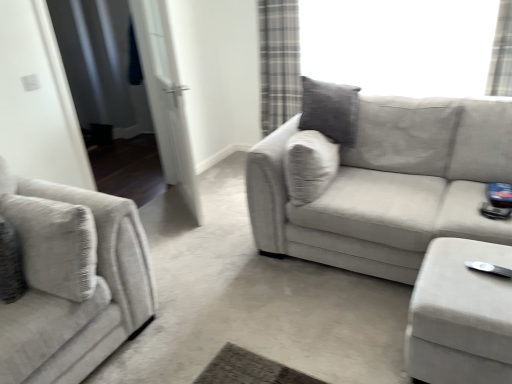
What do you see at coordinates (501, 54) in the screenshot? I see `plaid fabric curtain at upper right` at bounding box center [501, 54].

Identify the location of plaid fabric curtain at upper right. The width and height of the screenshot is (512, 384). (501, 54).

What do you see at coordinates (165, 97) in the screenshot?
I see `white glossy door at left, which is the 2th screen door from left to right` at bounding box center [165, 97].

The width and height of the screenshot is (512, 384). Find the location of `velvet beige ottoman at lower right`. velvet beige ottoman at lower right is located at coordinates (460, 316).

At what (x,y) coordinates should I click in order to perform the action: click on white plastic wii controller at lower right. Please return your answer as a coordinate pair (x, y). The height and width of the screenshot is (384, 512). Looking at the image, I should click on (x=489, y=269).

Consider the image. Which object is closer to the camera taking this photo, textured gray couch at left, placed as the 2th studio couch when sorted from right to left, or velvet beige ottoman at lower right?

textured gray couch at left, placed as the 2th studio couch when sorted from right to left, is closer to the camera.

Is point (82, 301) in front of point (463, 282)?

No, (82, 301) is further to viewer.

Considering the positions of objects textured gray couch at left, the 1th studio couch from the left, and velvet beige ottoman at lower right in the image provided, who is more to the left, textured gray couch at left, the 1th studio couch from the left, or velvet beige ottoman at lower right?

From the viewer's perspective, textured gray couch at left, the 1th studio couch from the left, appears more on the left side.

Is textured gray couch at left, placed as the 2th studio couch when sorted from right to left, next to velvet beige ottoman at lower right?

No, textured gray couch at left, placed as the 2th studio couch when sorted from right to left, is not next to velvet beige ottoman at lower right.

Based on their sizes in the image, would you say textured gray couch at left, the 1th studio couch from the left, is bigger or smaller than plaid fabric curtain at upper right?

Clearly, textured gray couch at left, the 1th studio couch from the left, is larger in size than plaid fabric curtain at upper right.

Can we say textured gray couch at left, placed as the 2th studio couch when sorted from right to left, lies outside plaid fabric curtain at upper right?

Yes.

Considering the positions of objects textured gray couch at left, the 1th studio couch from the left, and plaid fabric curtain at upper right in the image provided, who is behind, textured gray couch at left, the 1th studio couch from the left, or plaid fabric curtain at upper right?

plaid fabric curtain at upper right.

Considering the relative sizes of white plastic wii controller at lower right and textured gray couch at left, placed as the 2th studio couch when sorted from right to left, in the image provided, is white plastic wii controller at lower right smaller than textured gray couch at left, placed as the 2th studio couch when sorted from right to left,?

Indeed, white plastic wii controller at lower right has a smaller size compared to textured gray couch at left, placed as the 2th studio couch when sorted from right to left.

Would you say textured gray couch at left, placed as the 2th studio couch when sorted from right to left, is part of white plastic wii controller at lower right's contents?

That's incorrect, textured gray couch at left, placed as the 2th studio couch when sorted from right to left, is not inside white plastic wii controller at lower right.

Is the surface of white plastic wii controller at lower right in direct contact with textured gray couch at left, placed as the 2th studio couch when sorted from right to left?

No, white plastic wii controller at lower right is not beside textured gray couch at left, placed as the 2th studio couch when sorted from right to left.

Does point (486, 271) lie behind point (40, 210)?

That is False.

From the image's perspective, who appears lower, white fabric screen door at left, which is the 2th screen door in right-to-left order, or textured beige couch at center, which ranks as the second studio couch in left-to-right order?

textured beige couch at center, which ranks as the second studio couch in left-to-right order.

Is white fabric screen door at left, positioned as the first screen door in left-to-right order, not near textured beige couch at center, marked as the first studio couch in a right-to-left arrangement?

Indeed, white fabric screen door at left, positioned as the first screen door in left-to-right order, is not near textured beige couch at center, marked as the first studio couch in a right-to-left arrangement.

Which object is wider, white fabric screen door at left, positioned as the first screen door in left-to-right order, or textured beige couch at center, which ranks as the second studio couch in left-to-right order?

textured beige couch at center, which ranks as the second studio couch in left-to-right order, is wider.

Which object is further away from the camera, white fabric screen door at left, which is the 2th screen door in right-to-left order, or plaid fabric curtain at upper right?

plaid fabric curtain at upper right.

Is white fabric screen door at left, which is the 2th screen door in right-to-left order, to the left of plaid fabric curtain at upper right from the viewer's perspective?

Yes.

Identify the location of curtain behind the white fabric screen door at left, which is the 2th screen door in right-to-left order. (501, 54).

From a real-world perspective, which object stands above the other?

plaid fabric curtain at upper right, from a real-world perspective.

Which is behind, plaid fabric curtain at upper right or velvet beige ottoman at lower right?

Positioned behind is plaid fabric curtain at upper right.

Is plaid fabric curtain at upper right spatially inside velvet beige ottoman at lower right, or outside of it?

plaid fabric curtain at upper right is located beyond the bounds of velvet beige ottoman at lower right.

Which object is positioned more to the left, plaid fabric curtain at upper right or velvet beige ottoman at lower right?

Positioned to the left is velvet beige ottoman at lower right.

You are a GUI agent. You are given a task and a screenshot of the screen. Output one action in this format:
    pyautogui.click(x=<x>, y=<y>)
    Task: Click on the curtain above the white plastic wii controller at lower right (from a real-world perspective)
    The width and height of the screenshot is (512, 384).
    Given the screenshot: What is the action you would take?
    pyautogui.click(x=501, y=54)

Considering the sizes of objects white plastic wii controller at lower right and plaid fabric curtain at upper right in the image provided, who is smaller, white plastic wii controller at lower right or plaid fabric curtain at upper right?

white plastic wii controller at lower right is smaller.

Considering the relative positions of white plastic wii controller at lower right and plaid fabric curtain at upper right in the image provided, is white plastic wii controller at lower right to the right of plaid fabric curtain at upper right from the viewer's perspective?

Incorrect, white plastic wii controller at lower right is not on the right side of plaid fabric curtain at upper right.

Image resolution: width=512 pixels, height=384 pixels. Identify the location of studio couch in front of the velvet beige ottoman at lower right. (71, 280).

I want to click on curtain behind the textured gray couch at left, placed as the 2th studio couch when sorted from right to left, so click(501, 54).

Looking at the image, which one is located closer to plaid fabric curtain at upper right, white glossy door at left, marked as the 1th screen door in a right-to-left arrangement, or white fabric screen door at left, positioned as the first screen door in left-to-right order?

Based on the image, white glossy door at left, marked as the 1th screen door in a right-to-left arrangement, appears to be nearer to plaid fabric curtain at upper right.

From the picture: Which object lies nearer to the anchor point white plastic wii controller at lower right, textured gray couch at left, the 1th studio couch from the left, or white glossy door at left, marked as the 1th screen door in a right-to-left arrangement?

textured gray couch at left, the 1th studio couch from the left, is closer to white plastic wii controller at lower right.

When comparing their distances from plaid fabric curtain at upper right, does velvet beige ottoman at lower right or white fabric screen door at left, which is the 2th screen door in right-to-left order, seem closer?

Among the two, velvet beige ottoman at lower right is located nearer to plaid fabric curtain at upper right.

Based on their spatial positions, is plaid fabric curtain at upper right or textured gray couch at left, placed as the 2th studio couch when sorted from right to left, further from velvet beige ottoman at lower right?

Based on the image, plaid fabric curtain at upper right appears to be further to velvet beige ottoman at lower right.

Looking at the image, which one is located closer to white glossy door at left, which is the 2th screen door from left to right, textured beige couch at center, which ranks as the second studio couch in left-to-right order, or textured gray couch at left, placed as the 2th studio couch when sorted from right to left?

textured beige couch at center, which ranks as the second studio couch in left-to-right order, lies closer to white glossy door at left, which is the 2th screen door from left to right, than the other object.

Based on their spatial positions, is white glossy door at left, which is the 2th screen door from left to right, or plaid fabric curtain at upper right further from velvet beige ottoman at lower right?

plaid fabric curtain at upper right is further to velvet beige ottoman at lower right.

Looking at the image, which one is located further to textured beige couch at center, marked as the first studio couch in a right-to-left arrangement, white glossy door at left, marked as the 1th screen door in a right-to-left arrangement, or textured gray couch at left, placed as the 2th studio couch when sorted from right to left?

white glossy door at left, marked as the 1th screen door in a right-to-left arrangement, is further to textured beige couch at center, marked as the first studio couch in a right-to-left arrangement.

When comparing their distances from white plastic wii controller at lower right, does white fabric screen door at left, positioned as the first screen door in left-to-right order, or textured beige couch at center, which ranks as the second studio couch in left-to-right order, seem further?

white fabric screen door at left, positioned as the first screen door in left-to-right order, lies further to white plastic wii controller at lower right than the other object.

The height and width of the screenshot is (384, 512). Find the location of `studio couch between textured gray couch at left, the 1th studio couch from the left, and plaid fabric curtain at upper right, in the horizontal direction`. studio couch between textured gray couch at left, the 1th studio couch from the left, and plaid fabric curtain at upper right, in the horizontal direction is located at coordinates (379, 180).

This screenshot has width=512, height=384. I want to click on studio couch situated between white fabric screen door at left, which is the 2th screen door in right-to-left order, and plaid fabric curtain at upper right from left to right, so click(x=379, y=180).

You are a GUI agent. You are given a task and a screenshot of the screen. Output one action in this format:
    pyautogui.click(x=<x>, y=<y>)
    Task: Click on the Wii controller between white fabric screen door at left, which is the 2th screen door in right-to-left order, and plaid fabric curtain at upper right, in the horizontal direction
    
    Given the screenshot: What is the action you would take?
    pyautogui.click(x=489, y=269)

This screenshot has height=384, width=512. What are the coordinates of `Wii controller located between white glossy door at left, which is the 2th screen door from left to right, and plaid fabric curtain at upper right in the left-right direction` in the screenshot? It's located at (489, 269).